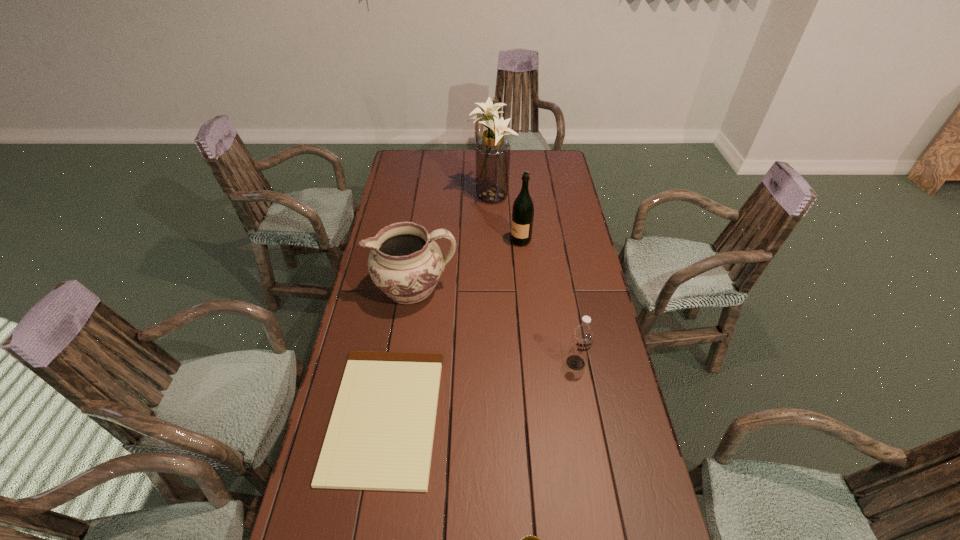
You are a GUI agent. You are given a task and a screenshot of the screen. Output one action in this format:
    pyautogui.click(x=<x>, y=<y>)
    Task: Click on the vacant space that satisfies the following two spatial constraints: 1. on the spout of the fourth nearest object; 2. on the front side of the shortest object
    
    Given the screenshot: What is the action you would take?
    click(x=396, y=415)

This screenshot has height=540, width=960. Identify the location of free spot that satisfies the following two spatial constraints: 1. on the front-facing side of the second farthest object; 2. on the front side of the shortest object. (539, 415).